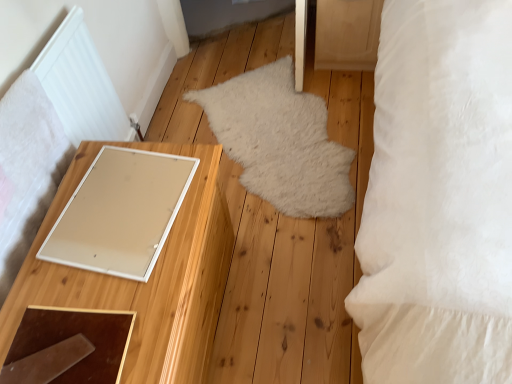
Question: Considering the positions of point (334, 18) and point (309, 216), is point (334, 18) closer or farther from the camera than point (309, 216)?

Choices:
 (A) closer
 (B) farther

Answer: (B)

Question: Considering the positions of wooden drawer at upper right and white fluffy rug at center in the image, is wooden drawer at upper right taller or shorter than white fluffy rug at center?

Choices:
 (A) tall
 (B) short

Answer: (A)

Question: Considering the real-world distances, which object is closest to the wooden drawer at upper right?

Choices:
 (A) white glossy board at left
 (B) white matte mirror at left
 (C) white fluffy rug at center
 (D) white soft pillow at right

Answer: (C)

Question: Considering the real-world distances, which object is farthest from the white glossy board at left?

Choices:
 (A) wooden drawer at upper right
 (B) white fluffy rug at center
 (C) white soft pillow at right
 (D) white matte mirror at left

Answer: (A)